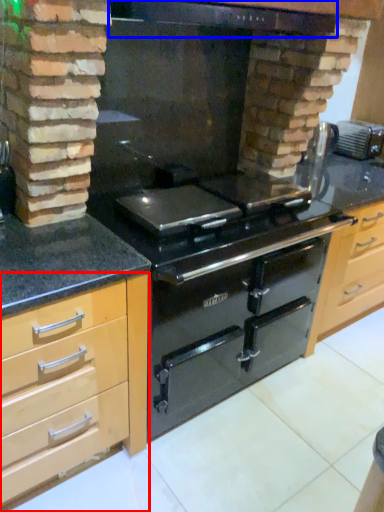
Question: Among these objects, which one is nearest to the camera, cabinetry (highlighted by a red box) or exhaust hood (highlighted by a blue box)?

Choices:
 (A) cabinetry
 (B) exhaust hood

Answer: (A)